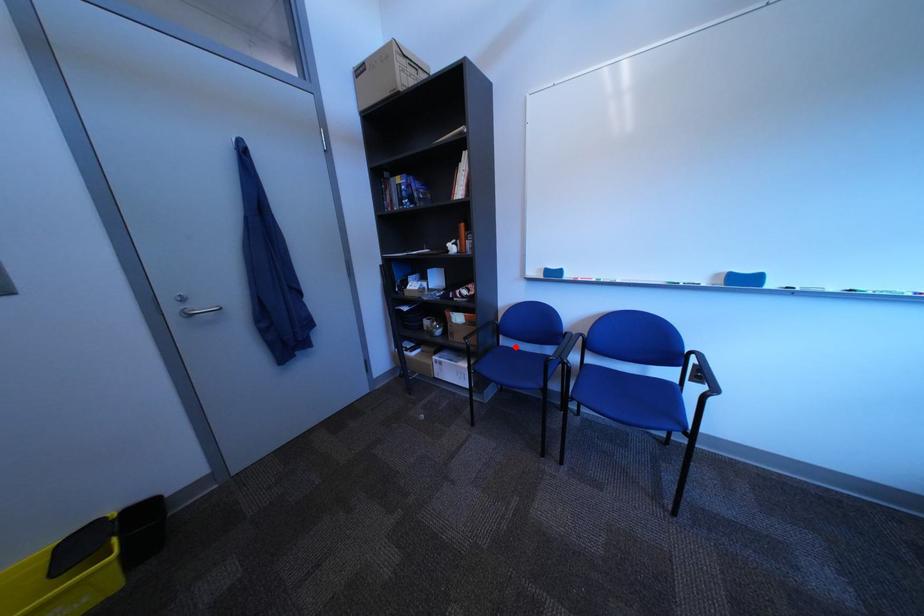
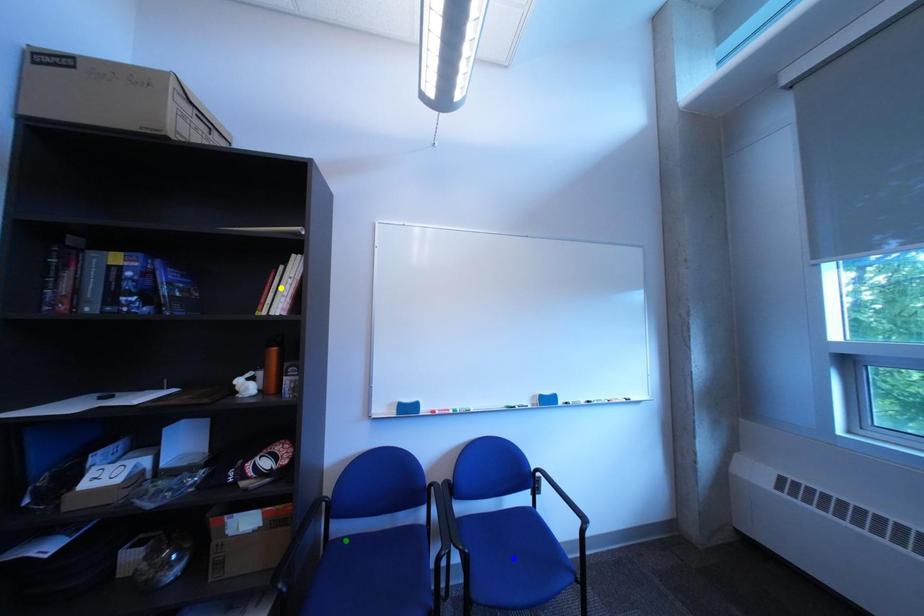
Question: I am providing you with two images of the same scene from different viewpoints. A red point is marked on the first image. You are given multiple points on the second image. In image 2, which mark is for the same physical point as the one in image 1?

Choices:
 (A) blue point
 (B) green point
 (C) yellow point

Answer: (B)